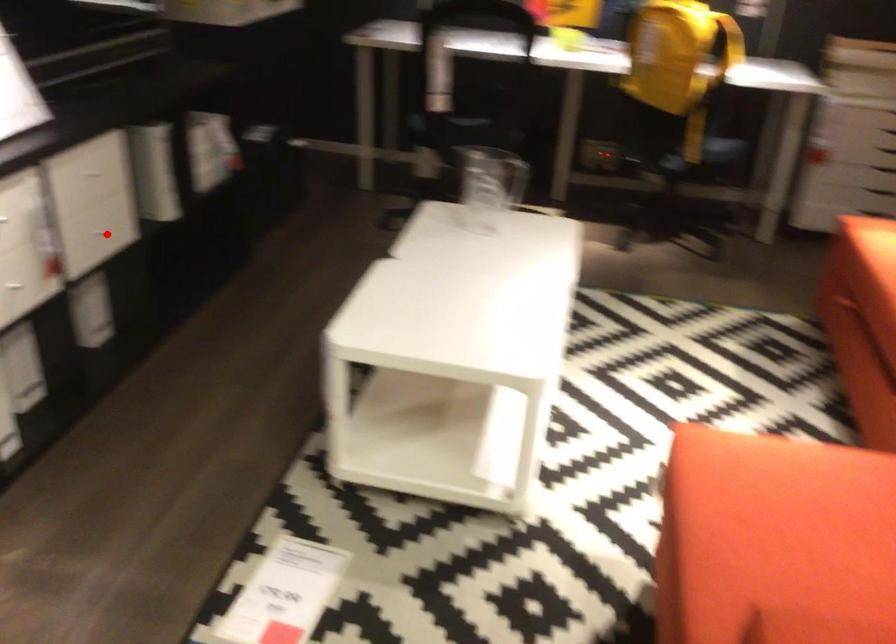
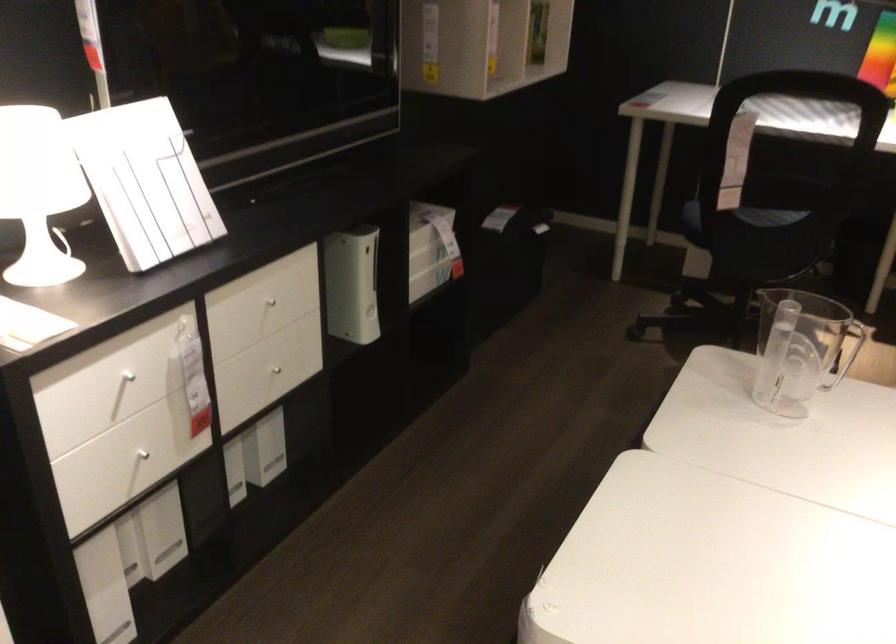
Question: I am providing you with two images of the same scene from different viewpoints. A red point is shown in image1. For the corresponding object point in image2, is it positioned nearer or farther from the camera?

Choices:
 (A) Nearer
 (B) Farther

Answer: (A)